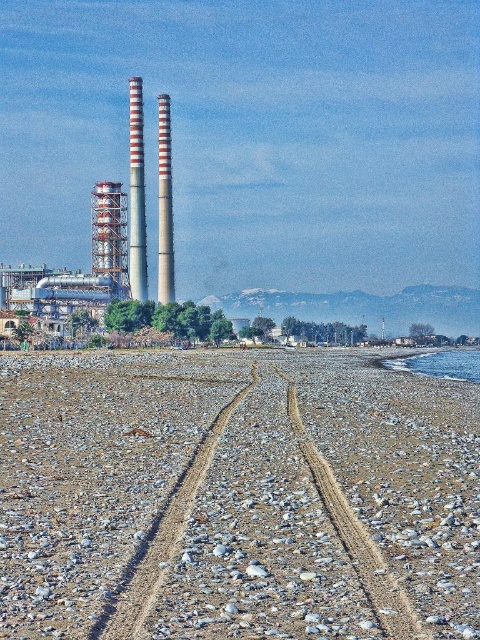
Is smooth pebbles at center bigger than red and white striped chimney at center?

Incorrect, smooth pebbles at center is not larger than red and white striped chimney at center.

Does smooth pebbles at center have a lesser height compared to red and white striped chimney at center?

Yes.

Find the location of a particular element. This screenshot has width=480, height=640. smooth pebbles at center is located at coordinates (236, 497).

Does red and white striped chimney at center appear on the right side of clear blue water at lower right?

No, red and white striped chimney at center is not to the right of clear blue water at lower right.

The width and height of the screenshot is (480, 640). What are the coordinates of `red and white striped chimney at center` in the screenshot? It's located at (165, 204).

This screenshot has width=480, height=640. In order to click on red and white striped chimney at center in this screenshot , I will do `click(165, 204)`.

Does smooth pebbles at center have a lesser height compared to red and white striped chimney at center-left?

Indeed, smooth pebbles at center has a lesser height compared to red and white striped chimney at center-left.

Can you confirm if smooth pebbles at center is bigger than red and white striped chimney at center-left?

Incorrect, smooth pebbles at center is not larger than red and white striped chimney at center-left.

Who is more distant from viewer, (x=192, y=356) or (x=142, y=205)?

Point (x=142, y=205)

The height and width of the screenshot is (640, 480). Find the location of `smooth pebbles at center`. smooth pebbles at center is located at coordinates click(x=236, y=497).